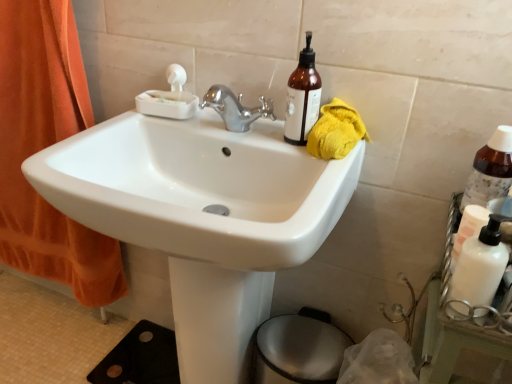
Find the location of a particular element. yellow cloth at upper right is located at coordinates coord(336,131).

The height and width of the screenshot is (384, 512). In order to click on translucent amber bottle at upper right, marked as the 1th bottle in a left-to-right arrangement in this screenshot , I will do `click(302, 97)`.

Image resolution: width=512 pixels, height=384 pixels. What do you see at coordinates (298, 350) in the screenshot? I see `metallic silver bidet at lower center` at bounding box center [298, 350].

Describe the element at coordinates (202, 216) in the screenshot. I see `white glossy sink at center` at that location.

What do you see at coordinates (468, 229) in the screenshot? This screenshot has height=384, width=512. I see `white matte bottle at right` at bounding box center [468, 229].

Find the location of a particular element. This screenshot has width=512, height=384. yellow cloth at upper right is located at coordinates point(336,131).

Between translucent amber bottle at right, the 1th bottle in the bottom-to-top sequence, and orange fabric curtain at left, which one appears on the right side from the viewer's perspective?

From the viewer's perspective, translucent amber bottle at right, the 1th bottle in the bottom-to-top sequence, appears more on the right side.

Is translucent amber bottle at right, arranged as the 2th bottle when viewed from the left, facing towards orange fabric curtain at left?

No, translucent amber bottle at right, arranged as the 2th bottle when viewed from the left, does not turn towards orange fabric curtain at left.

How distant is translucent amber bottle at right, arranged as the 2th bottle when viewed from the left, from orange fabric curtain at left?

translucent amber bottle at right, arranged as the 2th bottle when viewed from the left, is 3.63 feet away from orange fabric curtain at left.

Is translucent amber bottle at right, arranged as the 2th bottle when viewed from the left, not within orange fabric curtain at left?

Yes, translucent amber bottle at right, arranged as the 2th bottle when viewed from the left, is outside of orange fabric curtain at left.

From a real-world perspective, is metallic silver bidet at lower center located beneath white matte bottle at right?

Yes, from a real-world perspective, metallic silver bidet at lower center is below white matte bottle at right.

From the image's perspective, which is below, metallic silver bidet at lower center or white matte bottle at right?

metallic silver bidet at lower center is shown below in the image.

Does metallic silver bidet at lower center have a lesser height compared to white matte bottle at right?

Incorrect, the height of metallic silver bidet at lower center does not fall short of that of white matte bottle at right.

Can you confirm if white glossy sink at center is smaller than orange fabric curtain at left?

No, white glossy sink at center is not smaller than orange fabric curtain at left.

Is point (257, 305) behind point (9, 254)?

No.

From a real-world perspective, between white glossy sink at center and orange fabric curtain at left, who is vertically lower?

white glossy sink at center, from a real-world perspective.

How many degrees apart are the facing directions of white matte bottle at right and translucent amber bottle at right, positioned as the first bottle in right-to-left order?

white matte bottle at right and translucent amber bottle at right, positioned as the first bottle in right-to-left order, are facing 91.6 degrees away from each other.

Does white matte bottle at right contain translucent amber bottle at right, the 1th bottle in the bottom-to-top sequence?

Actually, translucent amber bottle at right, the 1th bottle in the bottom-to-top sequence, is outside white matte bottle at right.

Which is closer to the camera, (x=479, y=264) or (x=485, y=192)?

The point (x=479, y=264) is closer to the camera.

From a real-world perspective, between orange fabric curtain at left and translucent amber bottle at right, the 1th bottle in the bottom-to-top sequence, who is vertically higher?

From a 3D spatial view, translucent amber bottle at right, the 1th bottle in the bottom-to-top sequence, is above.

Are orange fabric curtain at left and translucent amber bottle at right, the 1th bottle in the bottom-to-top sequence, beside each other?

No, orange fabric curtain at left is not with translucent amber bottle at right, the 1th bottle in the bottom-to-top sequence.

Is translucent amber bottle at right, arranged as the 2th bottle when viewed from the left, completely or partially inside orange fabric curtain at left?

No, translucent amber bottle at right, arranged as the 2th bottle when viewed from the left, is not a part of orange fabric curtain at left.

Between point (22, 131) and point (485, 166), which one is positioned in front?

The point (485, 166) is closer.

Does point (500, 167) come closer to viewer compared to point (317, 126)?

Yes, point (500, 167) is closer to viewer.

Is translucent amber bottle at right, the 1th bottle in the bottom-to-top sequence, looking in the opposite direction of yellow cloth at upper right?

No, translucent amber bottle at right, the 1th bottle in the bottom-to-top sequence, is not facing away from yellow cloth at upper right.

Considering the relative positions of translucent amber bottle at right, positioned as the first bottle in right-to-left order, and yellow cloth at upper right in the image provided, is translucent amber bottle at right, positioned as the first bottle in right-to-left order, to the right of yellow cloth at upper right from the viewer's perspective?

Correct, you'll find translucent amber bottle at right, positioned as the first bottle in right-to-left order, to the right of yellow cloth at upper right.

Is translucent amber bottle at right, acting as the 2th bottle starting from the top, in front of or behind yellow cloth at upper right in the image?

translucent amber bottle at right, acting as the 2th bottle starting from the top, is in front of yellow cloth at upper right.

Relative to white matte bottle at right, is translucent amber bottle at upper right, the first bottle in the top-to-bottom sequence, in front or behind?

translucent amber bottle at upper right, the first bottle in the top-to-bottom sequence, is positioned farther from the viewer than white matte bottle at right.

Could you tell me if translucent amber bottle at upper right, marked as the 1th bottle in a left-to-right arrangement, is facing white matte bottle at right?

No, translucent amber bottle at upper right, marked as the 1th bottle in a left-to-right arrangement, is not turned towards white matte bottle at right.

Do you think translucent amber bottle at upper right, the second bottle from the bottom, is within white matte bottle at right, or outside of it?

translucent amber bottle at upper right, the second bottle from the bottom, lies outside white matte bottle at right.

Based on the photo, which object is positioned more to the left, translucent amber bottle at upper right, the second bottle from the bottom, or white matte bottle at right?

translucent amber bottle at upper right, the second bottle from the bottom.

The width and height of the screenshot is (512, 384). What are the coordinates of `curtain above the translucent amber bottle at right, positioned as the first bottle in right-to-left order (from the image's perspective)` in the screenshot? It's located at pos(47,146).

You are a GUI agent. You are given a task and a screenshot of the screen. Output one action in this format:
    pyautogui.click(x=<x>, y=<y>)
    Task: Click on the cleaning product above the metallic silver bidet at lower center (from a real-world perspective)
    
    Given the screenshot: What is the action you would take?
    pyautogui.click(x=478, y=270)

Looking at the image, which one is located further to white matte bottle at right, metallic silver bidet at lower center or white matte bottle at right?

Based on the image, metallic silver bidet at lower center appears to be further to white matte bottle at right.

When comparing their distances from white matte bottle at right, does white matte bottle at right or translucent amber bottle at upper right, the first bottle in the top-to-bottom sequence, seem closer?

Based on the image, white matte bottle at right appears to be nearer to white matte bottle at right.

From the image, which object appears to be nearer to white glossy sink at center, translucent amber bottle at right, acting as the 2th bottle starting from the top, or orange fabric curtain at left?

Among the two, orange fabric curtain at left is located nearer to white glossy sink at center.

Which object lies nearer to the anchor point yellow cloth at upper right, translucent amber bottle at right, arranged as the 2th bottle when viewed from the left, or orange fabric curtain at left?

The object closer to yellow cloth at upper right is translucent amber bottle at right, arranged as the 2th bottle when viewed from the left.

Which object lies nearer to the anchor point yellow cloth at upper right, metallic silver bidet at lower center or translucent amber bottle at upper right, the second bottle positioned from the right?

Among the two, translucent amber bottle at upper right, the second bottle positioned from the right, is located nearer to yellow cloth at upper right.

Looking at the image, which one is located further to yellow cloth at upper right, translucent amber bottle at right, acting as the 2th bottle starting from the top, or white matte bottle at right?

white matte bottle at right lies further to yellow cloth at upper right than the other object.

From the image, which object appears to be farther from white matte bottle at right, yellow cloth at upper right or orange fabric curtain at left?

orange fabric curtain at left is positioned further to the anchor white matte bottle at right.

Which object lies further to the anchor point white matte bottle at right, translucent amber bottle at upper right, the second bottle positioned from the right, or white matte bottle at right?

Among the two, translucent amber bottle at upper right, the second bottle positioned from the right, is located further to white matte bottle at right.

This screenshot has height=384, width=512. Find the location of `toiletry between yellow cloth at upper right and translucent amber bottle at right, the 1th bottle in the bottom-to-top sequence, in the horizontal direction`. toiletry between yellow cloth at upper right and translucent amber bottle at right, the 1th bottle in the bottom-to-top sequence, in the horizontal direction is located at coordinates (468, 229).

Locate an element on the screen. bidet between orange fabric curtain at left and white matte bottle at right from left to right is located at coordinates (298, 350).

This screenshot has width=512, height=384. In order to click on toiletry between translucent amber bottle at right, arranged as the 2th bottle when viewed from the left, and metallic silver bidet at lower center vertically in this screenshot , I will do `click(468, 229)`.

Locate an element on the screen. sink located between orange fabric curtain at left and translucent amber bottle at right, acting as the 2th bottle starting from the top, in the left-right direction is located at coordinates (202, 216).